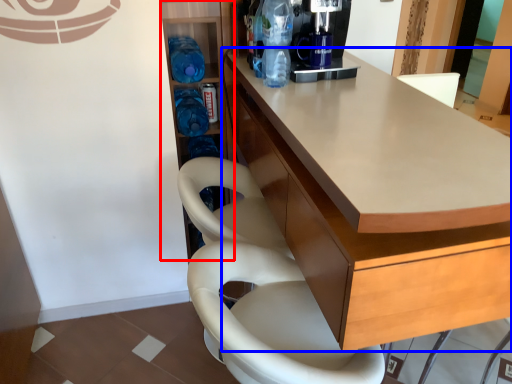
Question: Which point is closer to the camera, shelf (highlighted by a red box) or cabinetry (highlighted by a blue box)?

Choices:
 (A) shelf
 (B) cabinetry

Answer: (B)